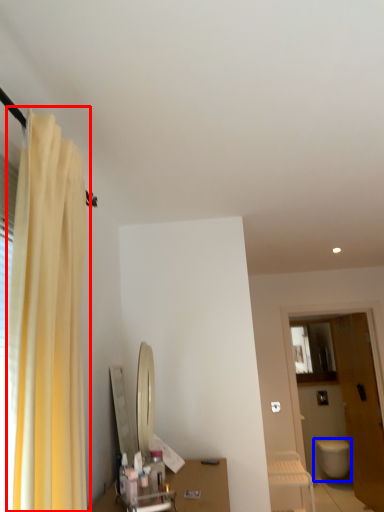
Question: Which object is closer to the camera taking this photo, curtain (highlighted by a red box) or toilet (highlighted by a blue box)?

Choices:
 (A) curtain
 (B) toilet

Answer: (A)